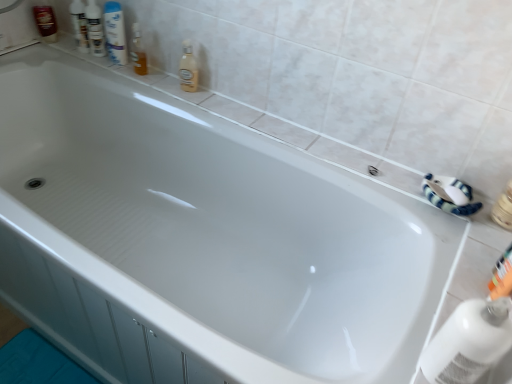
The image size is (512, 384). In order to click on free space to the left of orange plastic toothbrush at lower right, the fifth toiletry from the left in this screenshot , I will do `click(448, 284)`.